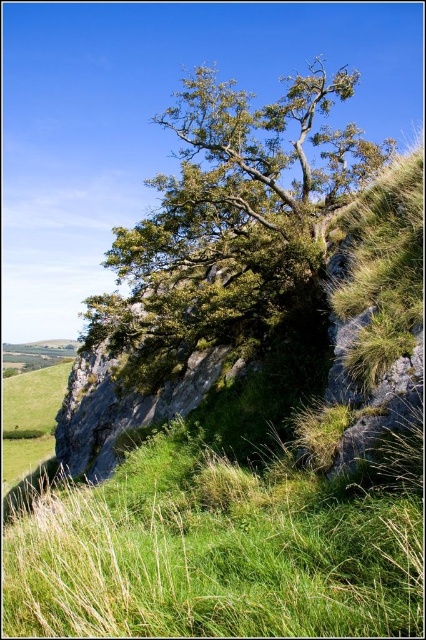
Is green grassy at lower left wider than green leafy tree at upper center?

No, green grassy at lower left is not wider than green leafy tree at upper center.

Looking at this image, does green grassy at lower left have a smaller size compared to green leafy tree at upper center?

Yes.

Which is in front, point (249, 564) or point (348, 168)?

Point (249, 564) is more forward.

Where is `green grassy at lower left`? green grassy at lower left is located at coordinates (215, 554).